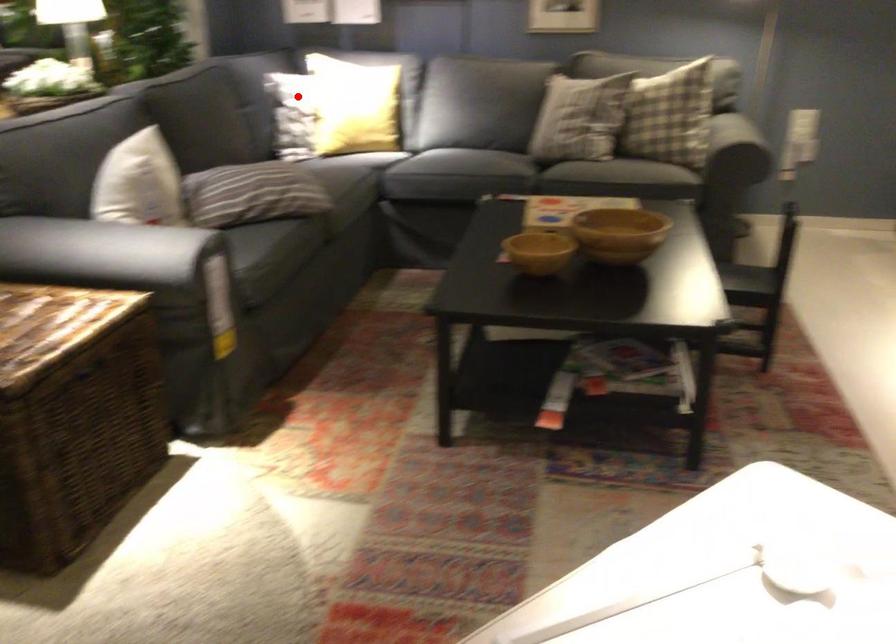
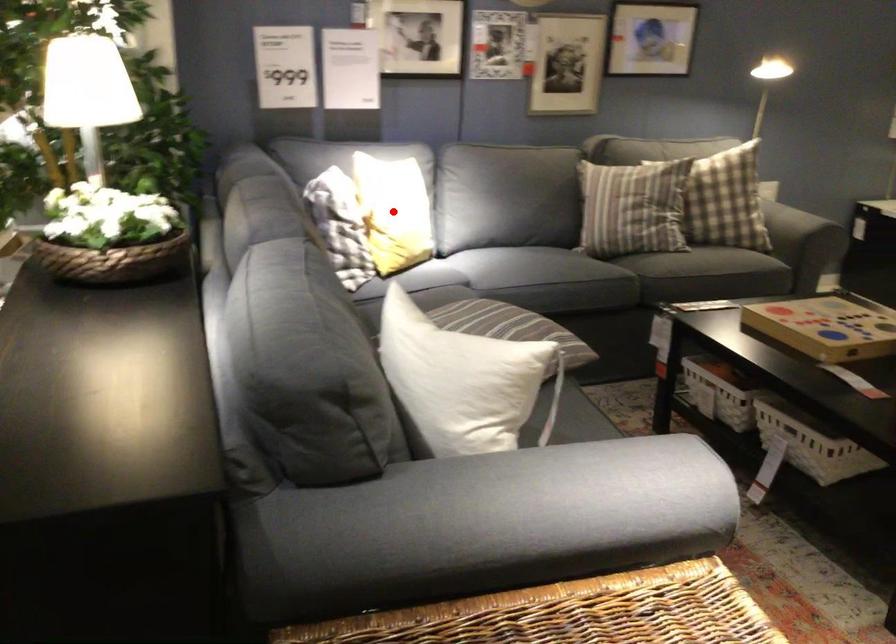
I am providing you with two images of the same scene from different viewpoints. A red point is marked on the first image and another point is marked on the second image. Is the marked point in image1 the same physical position as the marked point in image2?

Yes